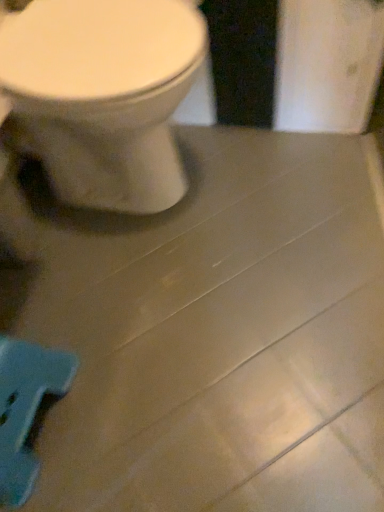
Where is `free space to the back side of blue plastic toy at lower left`? free space to the back side of blue plastic toy at lower left is located at coordinates (52, 303).